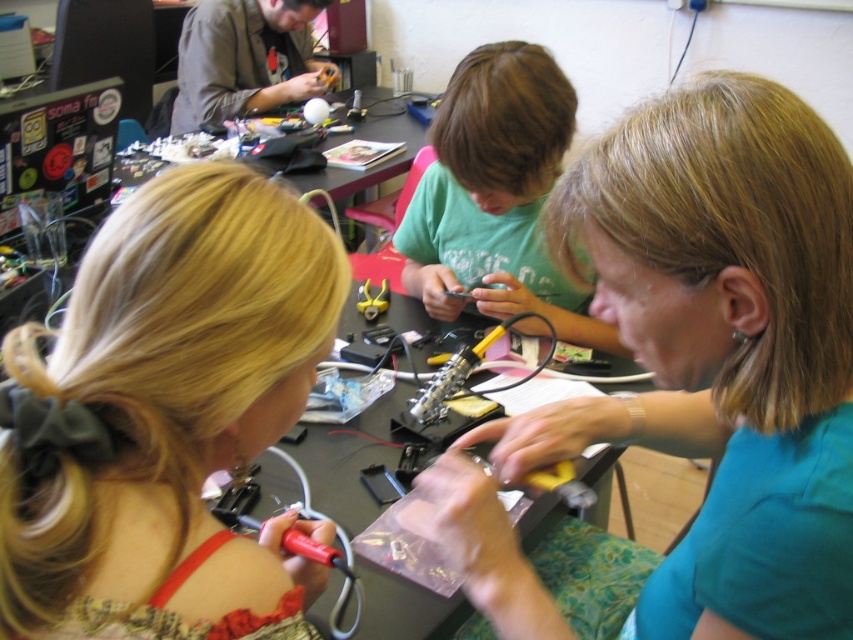
Who is higher up, teal matte shirt at center or green matte shirt at center?

green matte shirt at center

Is point (810, 380) closer to camera compared to point (567, 324)?

Yes, it is.

Is point (769, 620) closer to viewer compared to point (492, 301)?

Yes, it is.

Where is `teal matte shirt at center`? teal matte shirt at center is located at coordinates (698, 368).

Consider the image. Between blonde hair at lower left and green matte shirt at center, which one is positioned higher?

green matte shirt at center is higher up.

Is blonde hair at lower left to the right of green matte shirt at center from the viewer's perspective?

Incorrect, blonde hair at lower left is not on the right side of green matte shirt at center.

Which is in front, point (310, 253) or point (495, 148)?

Point (310, 253)

You are a GUI agent. You are given a task and a screenshot of the screen. Output one action in this format:
    pyautogui.click(x=<x>, y=<y>)
    Task: Click on the blonde hair at lower left
    The image size is (853, 640).
    Given the screenshot: What is the action you would take?
    pyautogui.click(x=165, y=417)

Between teal matte shirt at center and blonde hair at lower left, which one is positioned higher?

blonde hair at lower left is above.

Can you confirm if teal matte shirt at center is smaller than blonde hair at lower left?

Incorrect, teal matte shirt at center is not smaller in size than blonde hair at lower left.

Is point (798, 554) more distant than point (9, 424)?

No, it is not.

Where is `teal matte shirt at center`? This screenshot has height=640, width=853. teal matte shirt at center is located at coordinates (698, 368).